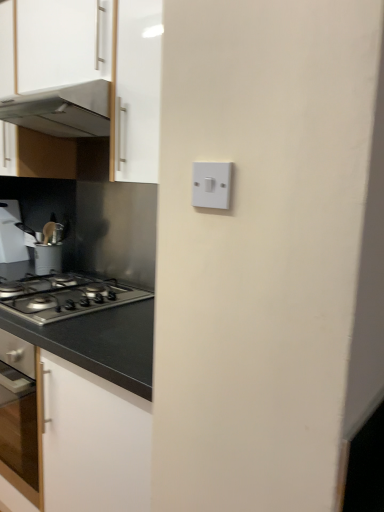
Image resolution: width=384 pixels, height=512 pixels. What do you see at coordinates (211, 185) in the screenshot?
I see `white plastic light switch at center` at bounding box center [211, 185].

This screenshot has width=384, height=512. What do you see at coordinates (62, 110) in the screenshot?
I see `metallic stainless steel range hood at upper left` at bounding box center [62, 110].

In order to face white glossy cabinet at upper left, should I rotate leftwards or rightwards?

A 16.222 degree turn to the left will do.

The height and width of the screenshot is (512, 384). Describe the element at coordinates (11, 233) in the screenshot. I see `brushed metal utensil holder at left` at that location.

This screenshot has height=512, width=384. Identify the location of white plastic light switch at center. (211, 185).

What's the angular difference between brushed metal utensil holder at left and white glossy cabinet at upper left's facing directions?

The facing directions of brushed metal utensil holder at left and white glossy cabinet at upper left are 92.9 degrees apart.

Considering the points (11, 230) and (41, 98), which point is behind, point (11, 230) or point (41, 98)?

The point (11, 230) is farther from the camera.

From a real-world perspective, between brushed metal utensil holder at left and white glossy cabinet at upper left, who is vertically lower?

brushed metal utensil holder at left.

Is brushed metal utensil holder at left smaller than white glossy cabinet at upper left?

Yes, brushed metal utensil holder at left is smaller than white glossy cabinet at upper left.

From the image's perspective, is white plastic light switch at center located beneath satin silver gas stove at lower left?

Actually, white plastic light switch at center appears above satin silver gas stove at lower left in the image.

Is white plastic light switch at center far away from satin silver gas stove at lower left?

white plastic light switch at center is actually quite close to satin silver gas stove at lower left.

Is white plastic light switch at center positioned with its back to satin silver gas stove at lower left?

No.

Who is shorter, white plastic light switch at center or satin silver gas stove at lower left?

Standing shorter between the two is satin silver gas stove at lower left.

Considering the positions of objects white glossy cabinet at upper left and brushed metal utensil holder at left in the image provided, who is more to the right, white glossy cabinet at upper left or brushed metal utensil holder at left?

white glossy cabinet at upper left.

Is white glossy cabinet at upper left facing towards brushed metal utensil holder at left?

No, white glossy cabinet at upper left is not facing towards brushed metal utensil holder at left.

Is brushed metal utensil holder at left located within white glossy cabinet at upper left?

No, brushed metal utensil holder at left is not a part of white glossy cabinet at upper left.

From the image's perspective, is brushed metal utensil holder at left beneath white plastic light switch at center?

No.

Looking at this image, can you confirm if brushed metal utensil holder at left is bigger than white plastic light switch at center?

Yes, brushed metal utensil holder at left is bigger than white plastic light switch at center.

Is brushed metal utensil holder at left spatially inside white plastic light switch at center, or outside of it?

brushed metal utensil holder at left lies outside white plastic light switch at center.

Considering the relative sizes of white plastic light switch at center and brushed metal utensil holder at left in the image provided, is white plastic light switch at center shorter than brushed metal utensil holder at left?

Indeed, white plastic light switch at center has a lesser height compared to brushed metal utensil holder at left.

From the image's perspective, is white plastic light switch at center on brushed metal utensil holder at left?

Incorrect, from the image's perspective, white plastic light switch at center is lower than brushed metal utensil holder at left.

Is white plastic light switch at center next to brushed metal utensil holder at left?

No, white plastic light switch at center is not making contact with brushed metal utensil holder at left.

From a real-world perspective, is white plastic light switch at center located beneath brushed metal utensil holder at left?

Actually, white plastic light switch at center is physically above brushed metal utensil holder at left in the real world.

In terms of width, does white plastic light switch at center look wider or thinner when compared to metallic stainless steel range hood at upper left?

In the image, white plastic light switch at center appears to be more narrow than metallic stainless steel range hood at upper left.

Between white plastic light switch at center and metallic stainless steel range hood at upper left, which one is positioned in front?

Positioned in front is white plastic light switch at center.

Is point (196, 181) in front of point (22, 123)?

Yes, it is in front of point (22, 123).

Does white plastic light switch at center turn towards white glossy cabinet at upper left?

No, white plastic light switch at center does not turn towards white glossy cabinet at upper left.

From a real-world perspective, who is located lower, white plastic light switch at center or white glossy cabinet at upper left?

In real-world perspective, white plastic light switch at center is lower.

Is white plastic light switch at center completely or partially outside of white glossy cabinet at upper left?

Yes, white plastic light switch at center is not within white glossy cabinet at upper left.

Who is shorter, white plastic light switch at center or white glossy cabinet at upper left?

white plastic light switch at center is shorter.

Find the location of `kitchen appliance below the white glossy cabinet at upper left (from a real-world perspective)`. kitchen appliance below the white glossy cabinet at upper left (from a real-world perspective) is located at coordinates [x=11, y=233].

There is a satin silver gas stove at lower left. Where is `light switch above it (from a real-world perspective)`? light switch above it (from a real-world perspective) is located at coordinates (211, 185).

Considering their positions, is brushed metal utensil holder at left positioned closer to metallic stainless steel range hood at upper left than satin silver gas stove at lower left?

The object closer to metallic stainless steel range hood at upper left is satin silver gas stove at lower left.

Which object lies nearer to the anchor point brushed metal utensil holder at left, white glossy cabinet at upper left or satin silver gas stove at lower left?

satin silver gas stove at lower left is closer to brushed metal utensil holder at left.

Looking at this image, looking at the image, which one is located further to white glossy cabinet at upper left, satin silver gas stove at lower left or metallic stainless steel range hood at upper left?

satin silver gas stove at lower left is positioned further to the anchor white glossy cabinet at upper left.

When comparing their distances from white plastic light switch at center, does metallic stainless steel range hood at upper left or brushed metal utensil holder at left seem closer?

Based on the image, metallic stainless steel range hood at upper left appears to be nearer to white plastic light switch at center.

Estimate the real-world distances between objects in this image. Which object is closer to white glossy cabinet at upper left, brushed metal utensil holder at left or satin silver gas stove at lower left?

Based on the image, satin silver gas stove at lower left appears to be nearer to white glossy cabinet at upper left.

When comparing their distances from white plastic light switch at center, does brushed metal utensil holder at left or satin silver gas stove at lower left seem closer?

The object closer to white plastic light switch at center is satin silver gas stove at lower left.

Considering their positions, is white glossy cabinet at upper left positioned closer to satin silver gas stove at lower left than white plastic light switch at center?

white glossy cabinet at upper left.

Considering their positions, is satin silver gas stove at lower left positioned further to white plastic light switch at center than metallic stainless steel range hood at upper left?

Among the two, metallic stainless steel range hood at upper left is located further to white plastic light switch at center.

Find the location of a particular element. home appliance located between white glossy cabinet at upper left and brushed metal utensil holder at left in the depth direction is located at coordinates (62, 110).

Identify the location of gas stove between white glossy cabinet at upper left and brushed metal utensil holder at left from front to back. (64, 296).

At what (x,y) coordinates should I click in order to perform the action: click on home appliance between white glossy cabinet at upper left and white plastic light switch at center. Please return your answer as a coordinate pair (x, y). Looking at the image, I should click on (62, 110).

Identify the location of cabinetry positioned between white plastic light switch at center and brushed metal utensil holder at left from near to far. (93, 75).